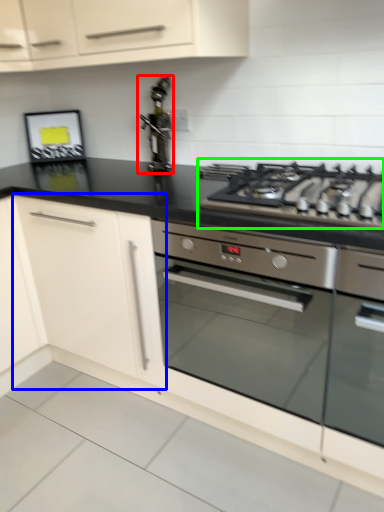
Question: Which object is positioned farthest from stainless steel (highlighted by a red box)? Select from cabinetry (highlighted by a blue box) and gas stove (highlighted by a green box).

Choices:
 (A) cabinetry
 (B) gas stove

Answer: (B)